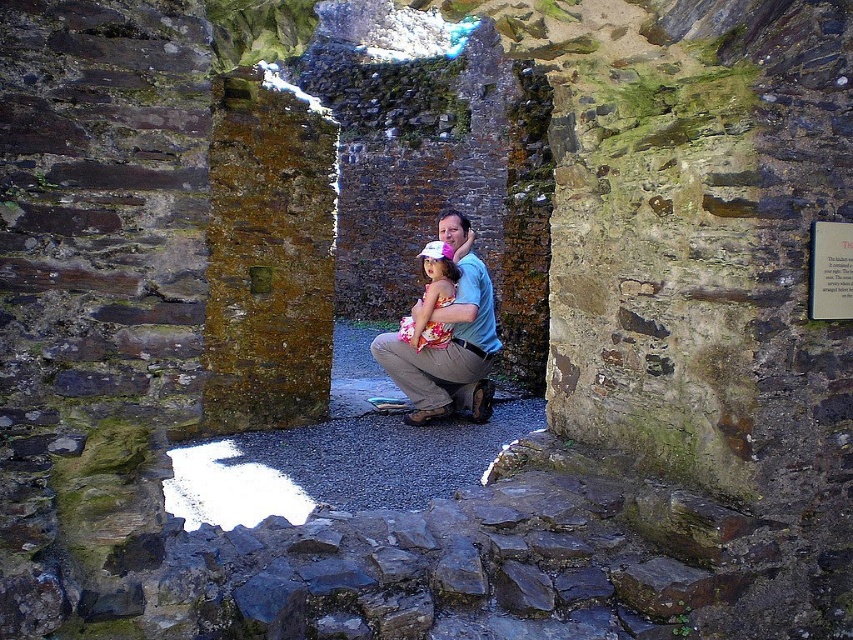
You are a photographer trying to capture a photo of the two subjects in the ruins. The man is wearing the matte blue shirt at center, and the girl is wearing the floral dress at center. Based on their positions, which clothing item is positioned more to the left in the image?

The floral dress at center is positioned more to the left because the matte blue shirt at center is to the right of it.

You are standing at the point labeled as point (448, 300) in the ruins. You want to move to the point labeled as point (480, 323). Which direction should you move relative to your current position?

To reach point (480, 323) from point (448, 300), you should move forward because point (480, 323) is behind point (448, 300).

You are a photographer trying to capture a photo of the matte blue shirt at center and the floral dress at center. Which clothing item should you focus on first if you want to ensure both are in frame without moving the camera?

The matte blue shirt at center has a larger width than the floral dress at center, so focusing on the matte blue shirt at center first would help ensure both fit within the frame since it occupies more space.